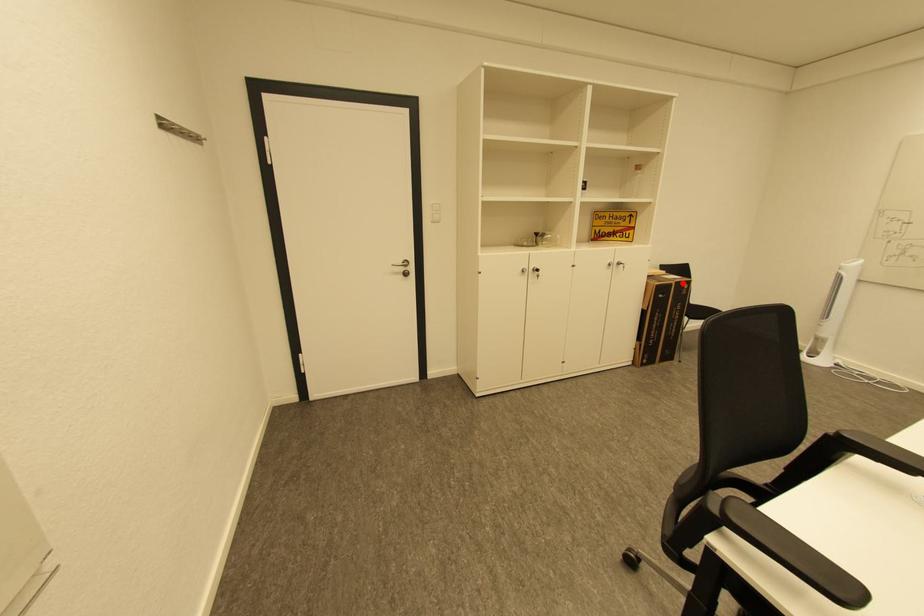
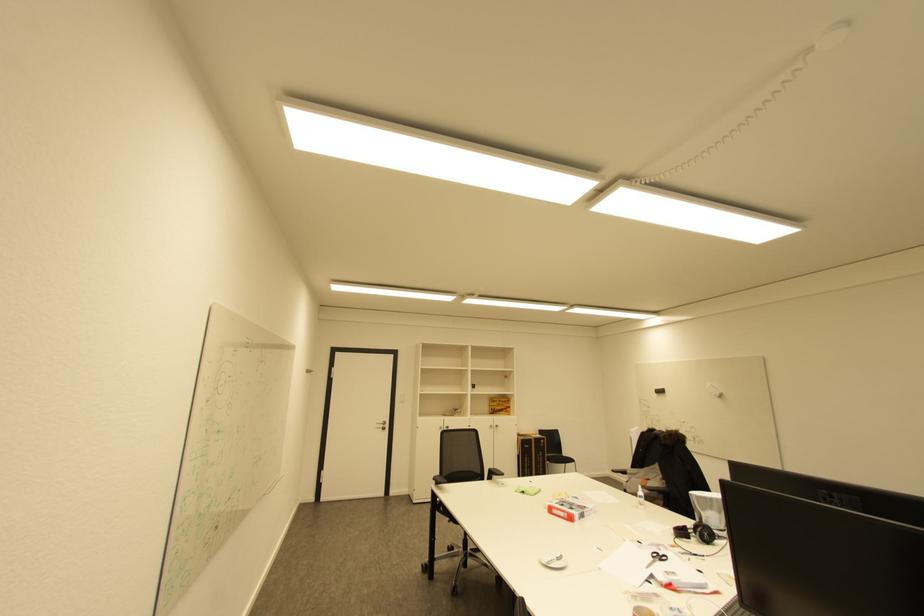
Locate, in the second image, the point that corresponds to the highlighted location in the first image.

(541, 439)